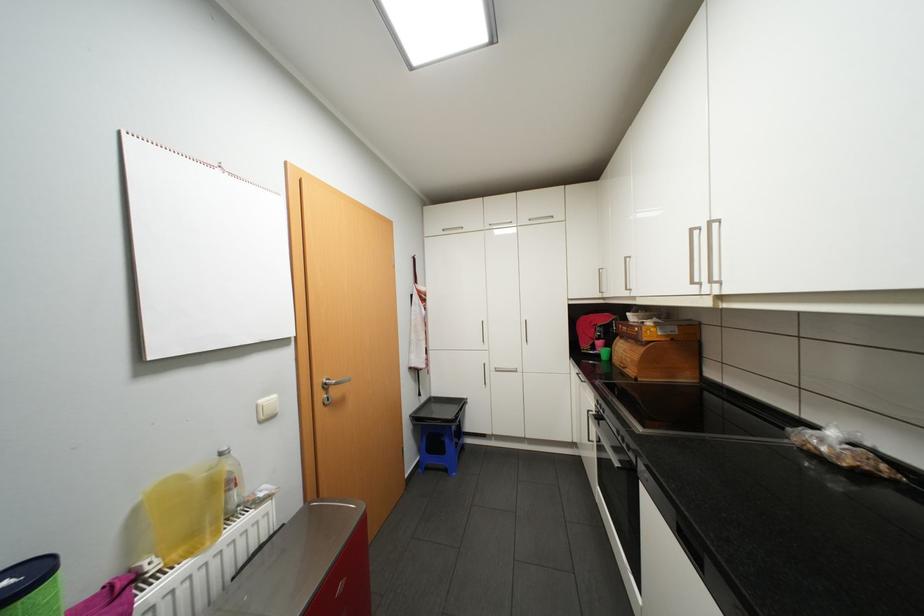
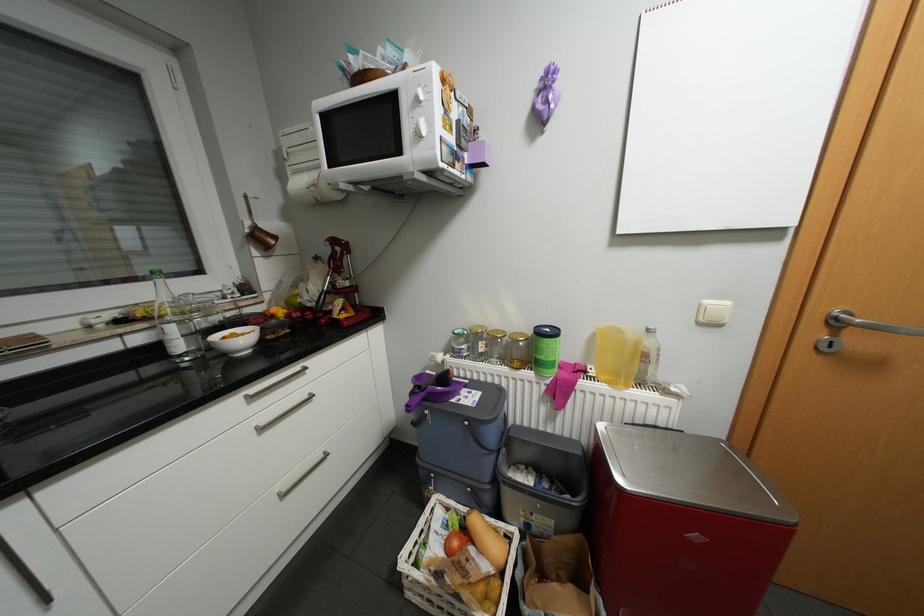
Based on the continuous images, in which direction is the camera rotating?

The camera rotated toward left-down.